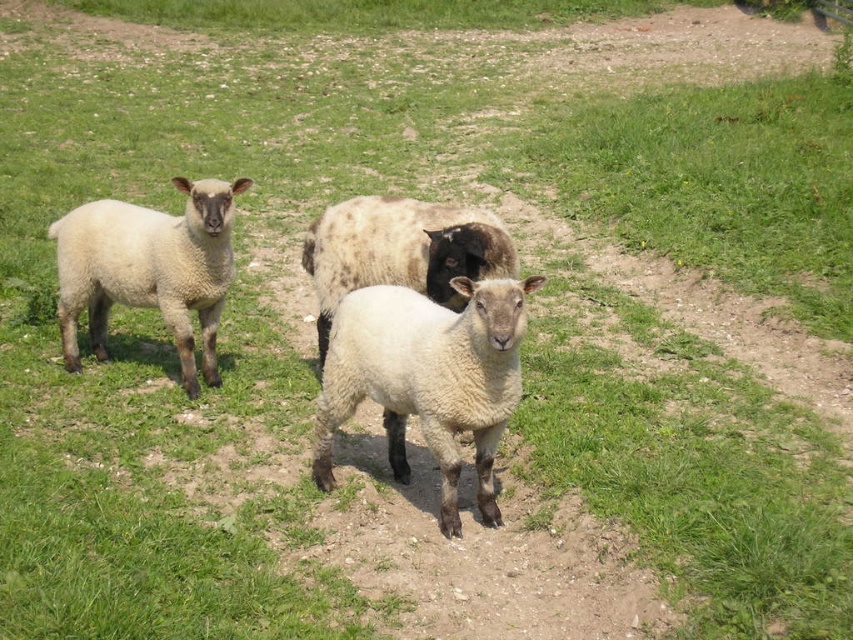
Question: Which point appears farthest from the camera in this image?

Choices:
 (A) (318, 476)
 (B) (479, 234)
 (C) (218, 291)

Answer: (C)

Question: Does white woolly lamb at left appear over white woolen sheep at center?

Choices:
 (A) no
 (B) yes

Answer: (A)

Question: Can you confirm if white woolly lamb at left is wider than white woolen sheep at center?

Choices:
 (A) yes
 (B) no

Answer: (A)

Question: Is white woolen lamb at center positioned behind white woolly lamb at left?

Choices:
 (A) no
 (B) yes

Answer: (A)

Question: Which object appears farthest from the camera in this image?

Choices:
 (A) white woolen sheep at center
 (B) white woolly lamb at left

Answer: (B)

Question: Estimate the real-world distances between objects in this image. Which object is closer to the white woolly lamb at left?

Choices:
 (A) white woolen sheep at center
 (B) white woolen lamb at center

Answer: (A)